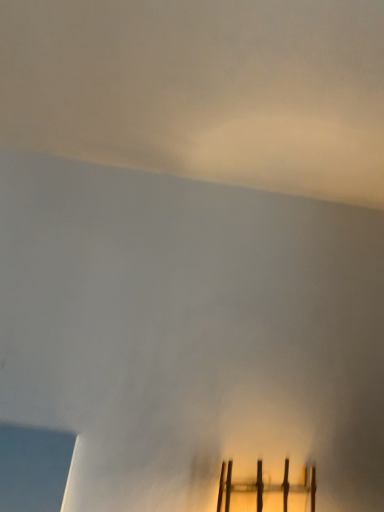
Image resolution: width=384 pixels, height=512 pixels. Describe the element at coordinates (203, 90) in the screenshot. I see `white matte cloud at upper center` at that location.

Measure the distance between white matte cloud at upper center and camera.

white matte cloud at upper center and camera are 72.80 centimeters apart.

Measure the distance between point (x=298, y=165) and camera.

Point (x=298, y=165) and camera are 3.75 feet apart from each other.

Locate an element on the screen. The image size is (384, 512). white matte cloud at upper center is located at coordinates (203, 90).

You are a GUI agent. You are given a task and a screenshot of the screen. Output one action in this format:
    pyautogui.click(x=<x>, y=<y>)
    Task: Click on the white matte cloud at upper center
    This screenshot has width=384, height=512.
    Given the screenshot: What is the action you would take?
    pyautogui.click(x=203, y=90)